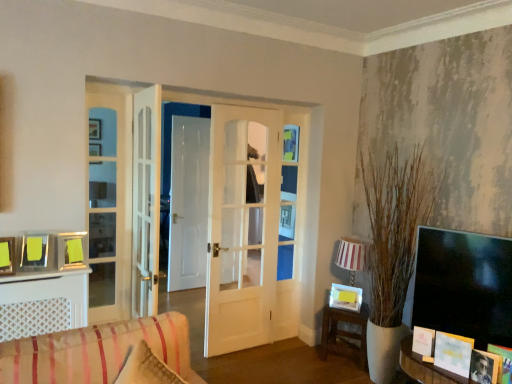
Question: Does point (471, 369) appear closer or farther from the camera than point (413, 342)?

Choices:
 (A) closer
 (B) farther

Answer: (A)

Question: Is matte black photo frame at lower right, the 2th picture frame from the front, inside or outside of white paper picture frame at lower right, which ranks as the fifth picture frame in top-to-bottom order?

Choices:
 (A) inside
 (B) outside

Answer: (B)

Question: Which object is the closest to the white paper picture frame at lower right, the 3th picture frame from the bottom?

Choices:
 (A) wooden picture frame at lower right, the seventh picture frame from the back
 (B) wooden table at lower right
 (C) white paper book at lower right
 (D) matte black photo frame at lower right, which is the 6th picture frame from left to right
 (E) matte silver picture frame at left, which appears as the 4th picture frame when viewed from the back

Answer: (C)

Question: Which object is positioned farthest from the yellow paper at lower right, which is counted as the 4th picture frame, starting from the left?

Choices:
 (A) white paper book at lower right
 (B) striped fabric sofa at lower left
 (C) wooden picture frame at lower right, the seventh picture frame positioned from the left
 (D) white paper picture frame at lower right, marked as the 3th picture frame in a back-to-front arrangement
 (E) wooden table at lower right

Answer: (B)